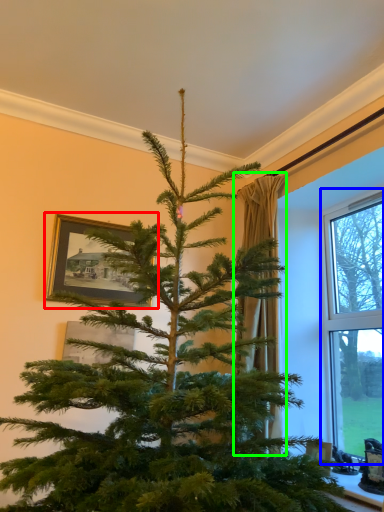
Question: Estimate the real-world distances between objects in this image. Which object is farther from picture frame (highlighted by a red box), window (highlighted by a blue box) or curtain (highlighted by a green box)?

Choices:
 (A) window
 (B) curtain

Answer: (A)